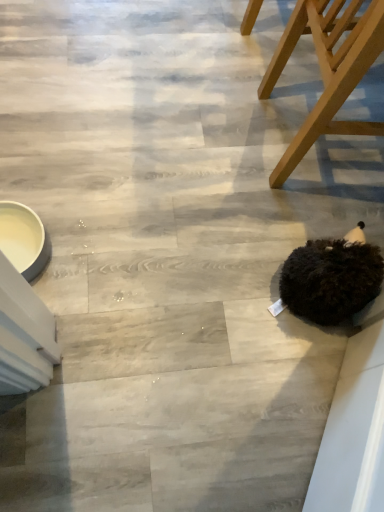
At what (x,y) coordinates should I click in order to perform the action: click on free point behind black fuzzy ball at lower right. Please return your answer as a coordinate pair (x, y). This screenshot has width=384, height=512. Looking at the image, I should click on (x=310, y=211).